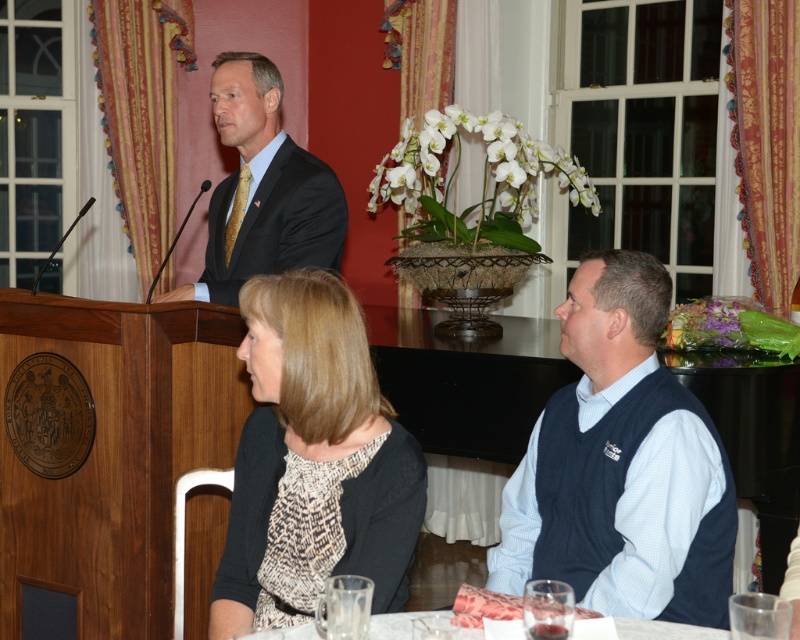
You are an event planner arranging seating for a formal dinner. You need to place a decorative centerpiece between the black knit sweater at lower left and the matte black suit at center. Based on their positions, where should the centerpiece be placed?

The black knit sweater at lower left is positioned under the matte black suit at center, so the centerpiece should be placed between them at the lower center area to ensure visibility and accessibility for both guests.

In the scene shown: Please look at the point marked at coordinates [621,465]. What object is located there?

The point at coordinates [621,465] corresponds to the navy blue sweater vest at right.

You are organizing a photo shoot and need to arrange two models wearing the black knit sweater at lower left and the matte black suit at center. Based on their clothing widths, which model should you place on the narrower side of the frame to ensure proper visibility?

The black knit sweater at lower left has a lesser width compared to the matte black suit at center, so the model wearing the black knit sweater at lower left should be placed on the narrower side of the frame to ensure proper visibility.